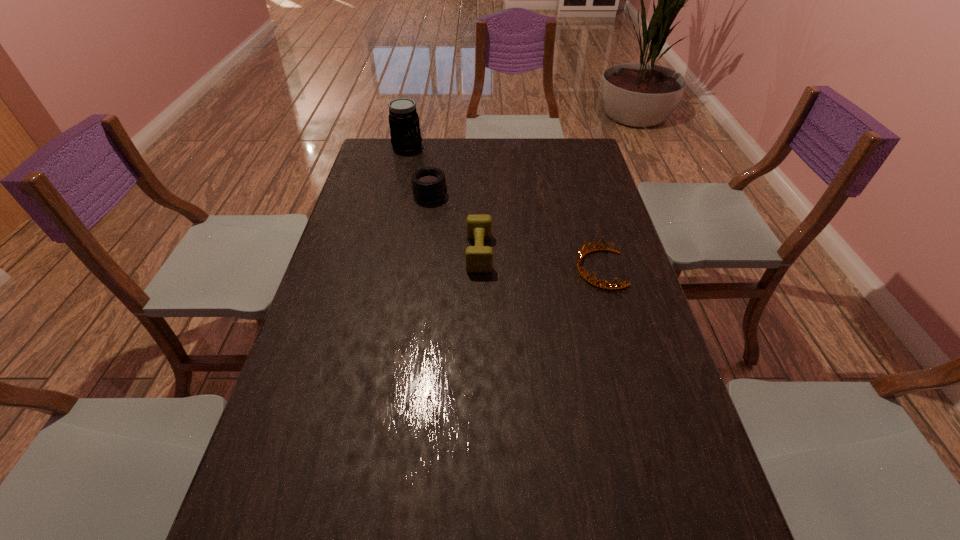
Find the location of a particular element. vacant area situated on the front-facing side of the tiara is located at coordinates (489, 269).

You are a GUI agent. You are given a task and a screenshot of the screen. Output one action in this format:
    pyautogui.click(x=<x>, y=<y>)
    Task: Click on the free space located on the front-facing side of the tiara
    This screenshot has width=960, height=540.
    Given the screenshot: What is the action you would take?
    pyautogui.click(x=519, y=269)

This screenshot has height=540, width=960. In order to click on object that is at the far edge in this screenshot , I will do `click(405, 133)`.

At what (x,y) coordinates should I click in order to perform the action: click on object that is positioned at the left edge. Please return your answer as a coordinate pair (x, y). Image resolution: width=960 pixels, height=540 pixels. Looking at the image, I should click on (405, 133).

At what (x,y) coordinates should I click in order to perform the action: click on object present at the right edge. Please return your answer as a coordinate pair (x, y). Image resolution: width=960 pixels, height=540 pixels. Looking at the image, I should click on (580, 255).

Identify the location of object that is at the far left corner. The image size is (960, 540). (405, 133).

Where is `vacant space at the far edge`? vacant space at the far edge is located at coordinates (449, 163).

The width and height of the screenshot is (960, 540). In order to click on free space at the left edge of the desktop in this screenshot , I will do `click(321, 375)`.

At what (x,y) coordinates should I click in order to perform the action: click on vacant space at the right edge. Please return your answer as a coordinate pair (x, y). Image resolution: width=960 pixels, height=540 pixels. Looking at the image, I should click on (585, 177).

This screenshot has width=960, height=540. Identify the location of vacant space at the far left corner of the desktop. [x=372, y=139].